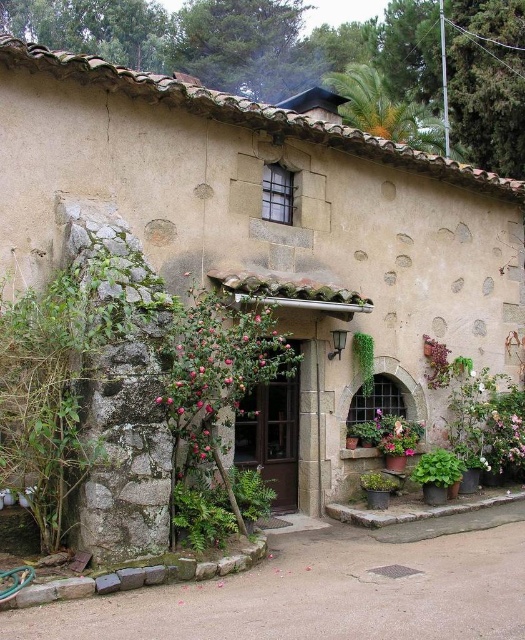
Can you confirm if green mossy stone wall at left is shorter than pink matte rose at center?

In fact, green mossy stone wall at left may be taller than pink matte rose at center.

Is green mossy stone wall at left positioned at the back of pink matte rose at center?

No, green mossy stone wall at left is closer to the viewer.

Is point (99, 346) farther from viewer compared to point (242, 305)?

No, it is in front of (242, 305).

Where is `green mossy stone wall at left`? This screenshot has width=525, height=640. green mossy stone wall at left is located at coordinates (70, 378).

I want to click on green mossy stone wall at left, so click(70, 378).

Is green mossy stone wall at left closer to the viewer compared to green leafy plant at lower right?

Yes, it is in front of green leafy plant at lower right.

Locate an element on the screen. Image resolution: width=525 pixels, height=640 pixels. green mossy stone wall at left is located at coordinates (70, 378).

Who is higher up, pink matte rose at center or green leafy plant at lower right?

pink matte rose at center is higher up.

Who is lower down, pink matte rose at center or green leafy plant at lower right?

green leafy plant at lower right is below.

Which is in front, point (189, 310) or point (436, 461)?

Point (189, 310) is in front.

Locate an element on the screen. This screenshot has height=640, width=525. pink matte rose at center is located at coordinates (216, 364).